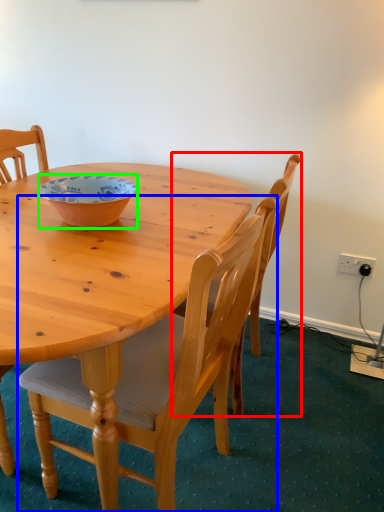
Question: Which object is the farthest from chair (highlighted by a red box)? Choose among these: chair (highlighted by a blue box) or bowl (highlighted by a green box).

Choices:
 (A) chair
 (B) bowl

Answer: (B)